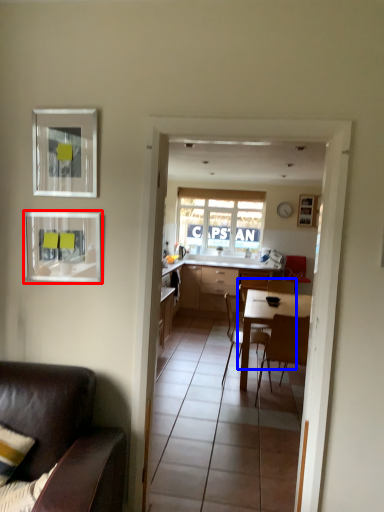
Question: Which point is closer to the camera, picture frame (highlighted by a red box) or chair (highlighted by a blue box)?

Choices:
 (A) picture frame
 (B) chair

Answer: (A)